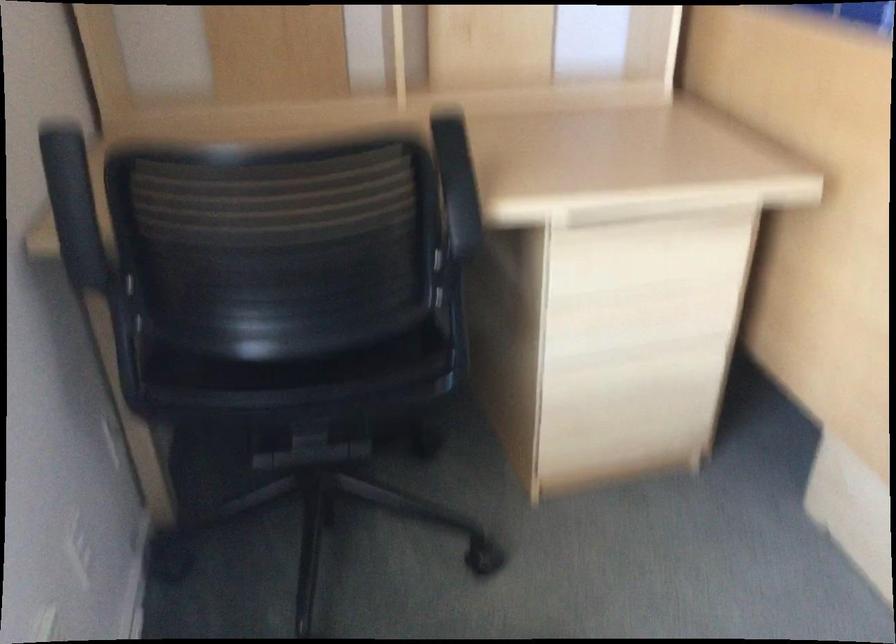
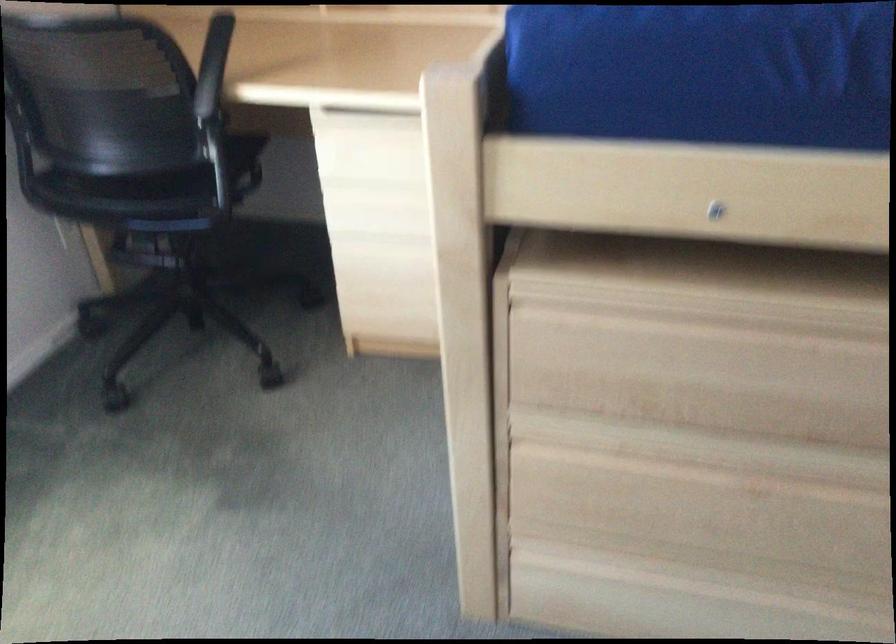
Question: The images are taken continuously from a first-person perspective. In which direction are you moving?

Choices:
 (A) Left
 (B) Right
 (C) Forward
 (D) Backward

Answer: (B)